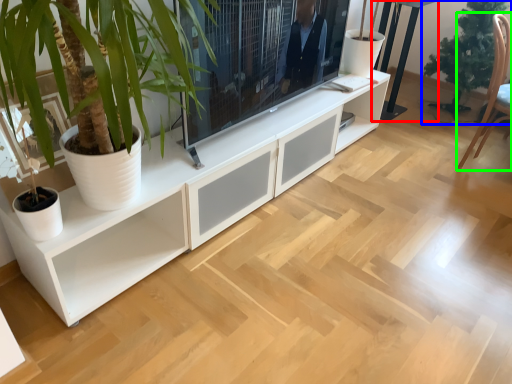
Question: Which object is positioned farthest from table (highlighted by a red box)? Select from houseplant (highlighted by a blue box) and armchair (highlighted by a green box).

Choices:
 (A) houseplant
 (B) armchair

Answer: (B)